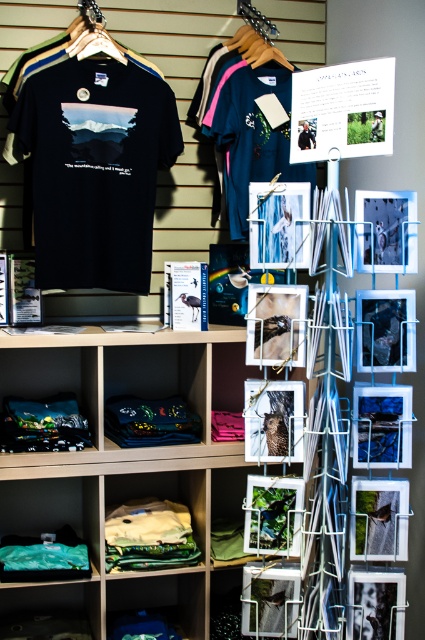
Question: Can you confirm if wooden bookshelf at center is positioned to the right of wooden hanger at upper center?

Choices:
 (A) yes
 (B) no

Answer: (B)

Question: Which point is closer to the camera?

Choices:
 (A) light yellow fabric at lower left
 (B) matte black t-shirt at center

Answer: (B)

Question: Where is wooden bookshelf at center located in relation to light yellow fabric at lower left in the image?

Choices:
 (A) right
 (B) left

Answer: (A)

Question: Among these points, which one is nearest to the camera?

Choices:
 (A) pos(85,3)
 (B) pos(192,576)

Answer: (A)

Question: Is matte black t-shirt at left below dark blue t-shirt at center?

Choices:
 (A) yes
 (B) no

Answer: (A)

Question: Among these objects, which one is farthest from the camera?

Choices:
 (A) wooden hanger at upper center
 (B) light yellow fabric at lower left
 (C) dark blue t-shirt at center
 (D) wooden bookshelf at center

Answer: (A)